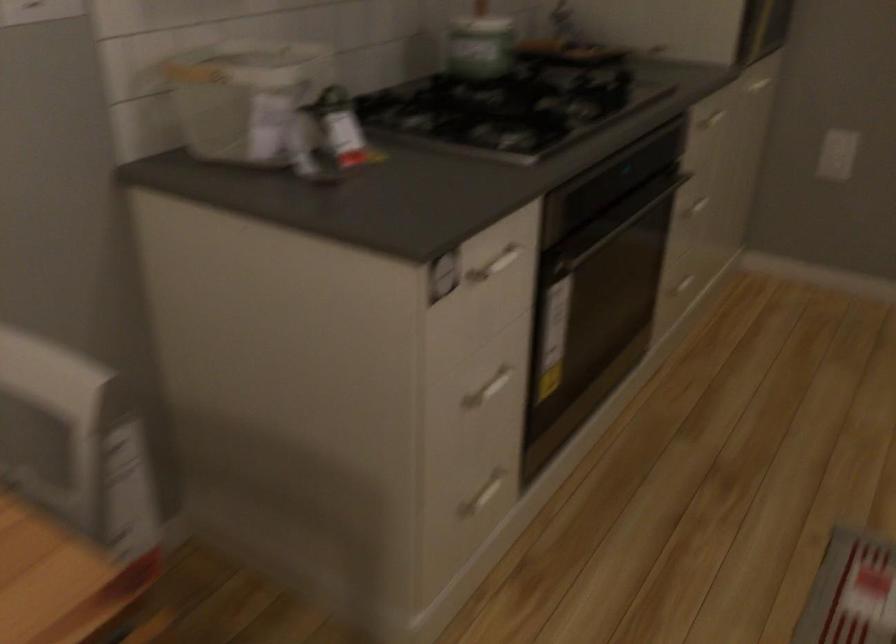
In order to click on white plastic bucket in this screenshot , I will do `click(244, 96)`.